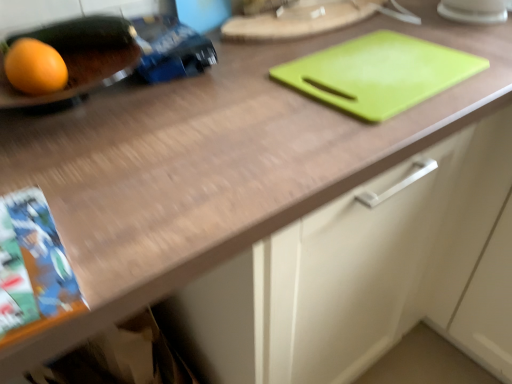
Locate an element on the screen. This screenshot has width=512, height=384. vacant area that lies to the right of matte black tray at left, the 3th tray when ordered from right to left is located at coordinates (184, 89).